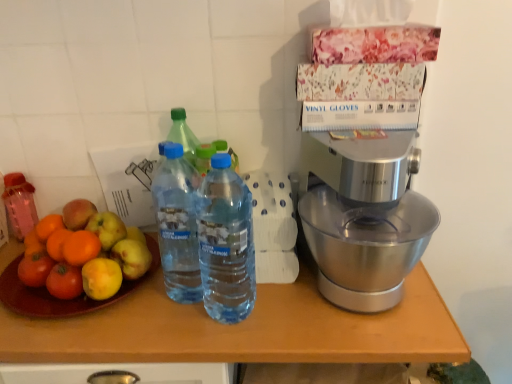
Locate an element on the screen. The height and width of the screenshot is (384, 512). vacant space to the right of blue plastic bottle at center, placed as the second bottle when sorted from right to left is located at coordinates (297, 314).